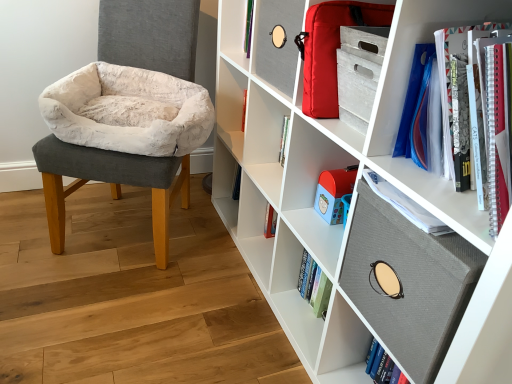
The height and width of the screenshot is (384, 512). Identify the location of free space above matte red bag at upper right, the first cabinet positioned from the top (from a real-world perspective). (366, 2).